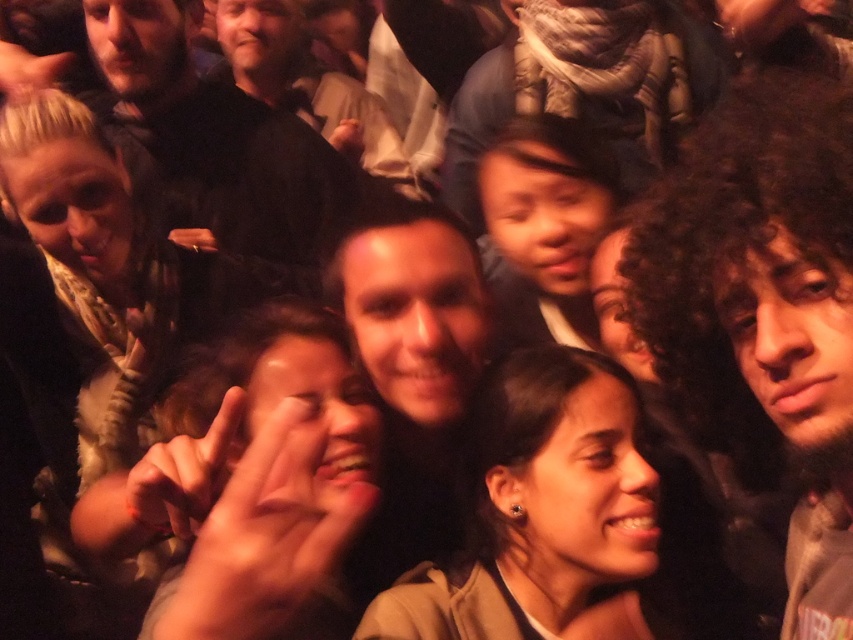
Question: Which object is positioned closest to the matte black hand at center?

Choices:
 (A) smooth skin hand at upper left
 (B) skinny flesh-toned hand at center
 (C) matte black ring at center
 (D) smooth skin hand at center

Answer: (C)

Question: Can you confirm if smooth skin hand at center is smaller than matte black ring at center?

Choices:
 (A) no
 (B) yes

Answer: (A)

Question: Is smooth skin hand at center bigger than smooth skin hand at upper left?

Choices:
 (A) no
 (B) yes

Answer: (B)

Question: Can you confirm if smooth skin hand at upper left is positioned above matte black hand at center?

Choices:
 (A) yes
 (B) no

Answer: (B)

Question: Based on their relative distances, which object is nearer to the matte black ring at center?

Choices:
 (A) smooth skin hand at center
 (B) matte black hand at center
 (C) smooth skin hand at upper left
 (D) skinny flesh-toned hand at center

Answer: (C)

Question: Among these objects, which one is farthest from the camera?

Choices:
 (A) smooth skin hand at upper left
 (B) skinny flesh-toned hand at center
 (C) matte black ring at center
 (D) matte black hand at center

Answer: (D)